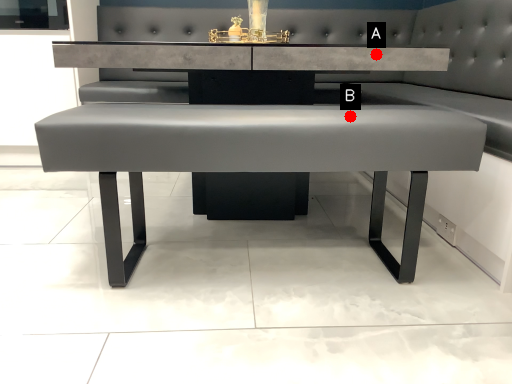
Question: Two points are circled on the image, labeled by A and B beside each circle. Which point is closer to the camera?

Choices:
 (A) A is closer
 (B) B is closer

Answer: (B)